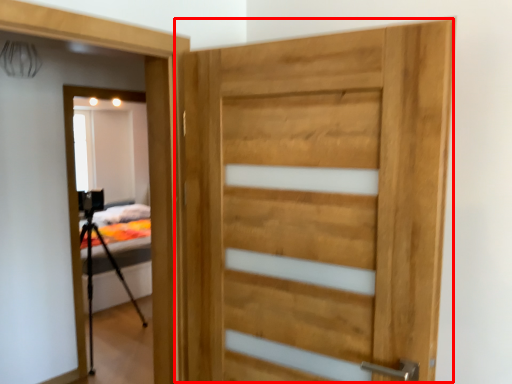
Question: From the image's perspective, what is the correct spatial positioning of door (annotated by the red box) in reference to tripod?

Choices:
 (A) above
 (B) below

Answer: (A)